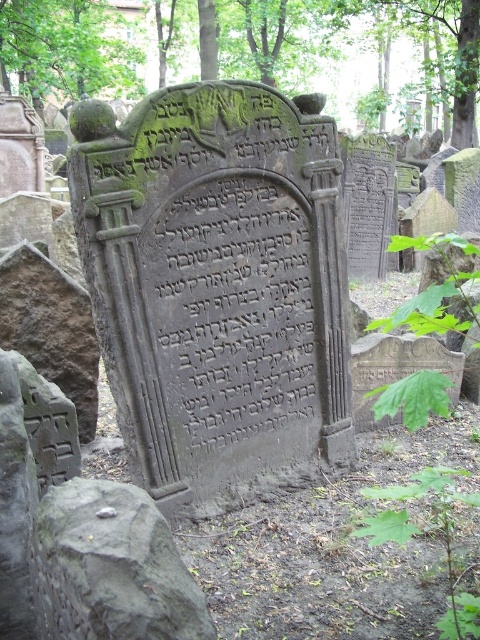
You are standing in an old Jewish cemetery and want to place a flower at the base of the green mossy stone monument at center. If your reach extends 1.8 meters, can you place the flower without moving closer?

The distance between you and the green mossy stone monument at center is 2.15 meters. Since your reach is only 1.8 meters, you cannot place the flower without moving closer.

You are a photographer standing at the camera position in the cemetery scene. You want to take a photo of the green mossy tree at upper center. Given that your camera has a maximum focus range of 12 meters, will you be able to capture the tree clearly?

The green mossy tree at upper center is 11.98 meters away from the camera, which is within the 12 meter maximum focus range. Therefore, the camera can focus on the green mossy tree at upper center clearly.